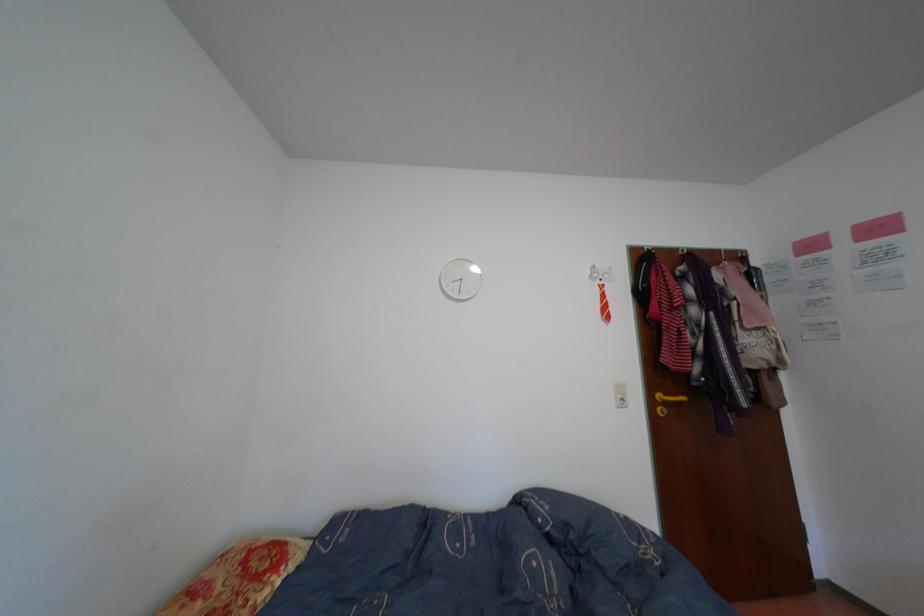
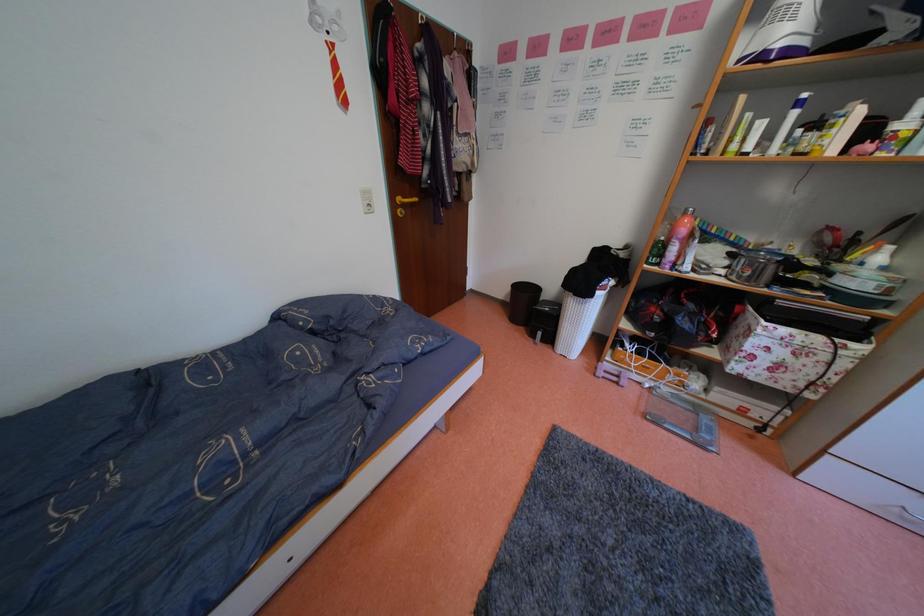
Based on the continuous images, in which direction is the camera rotating?

The camera's rotation is toward right-down.